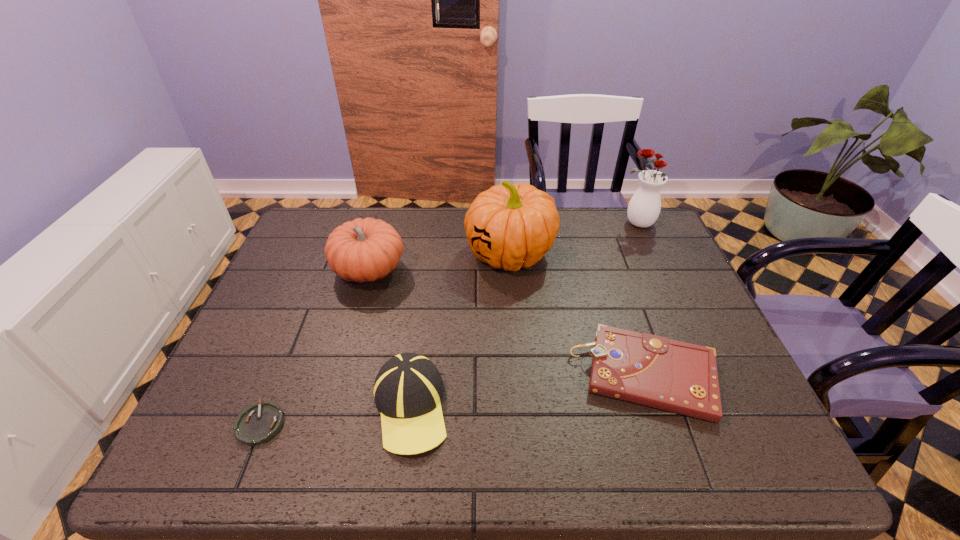
The image size is (960, 540). Find the location of `vacant space situated 0.350m on the surface of the right pumpkin`. vacant space situated 0.350m on the surface of the right pumpkin is located at coordinates (349, 254).

Where is `vacant space located on the back of the left pumpkin`? Image resolution: width=960 pixels, height=540 pixels. vacant space located on the back of the left pumpkin is located at coordinates (383, 224).

The image size is (960, 540). I want to click on blank space located on the left of the notebook, so click(x=433, y=375).

Locate an element on the screen. free space located 0.120m on the back of the shortest object is located at coordinates (287, 358).

What are the coordinates of `vase that is at the far edge` in the screenshot? It's located at (644, 207).

Where is `baseball cap that is at the near edge`? The width and height of the screenshot is (960, 540). baseball cap that is at the near edge is located at coordinates (408, 389).

I want to click on ashtray that is positioned at the near edge, so click(x=257, y=424).

I want to click on pumpkin that is at the left edge, so click(363, 250).

Image resolution: width=960 pixels, height=540 pixels. What are the coordinates of `ashtray located in the left edge section of the desktop` in the screenshot? It's located at (257, 424).

This screenshot has width=960, height=540. What are the coordinates of `vase located in the right edge section of the desktop` in the screenshot? It's located at (644, 207).